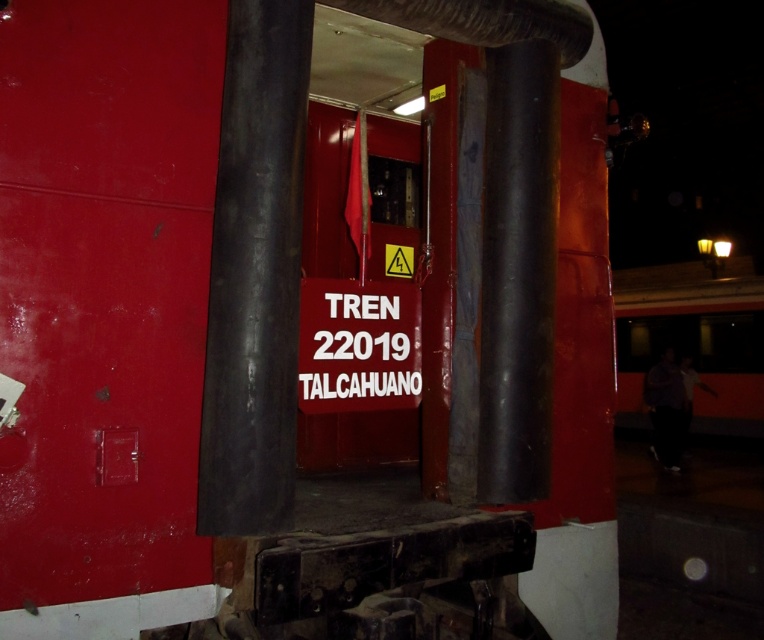
You are a maintenance worker standing 10 feet away from the smooth black pole at center and the white plastic sign at center. You need to reach both objects to inspect them. Which object is closer to you?

The smooth black pole at center is 20.58 inches from the white plastic sign at center. Since you are 10 feet away from both objects, their distance from you is the same. Therefore, both objects are equally close to you.

You are a maintenance worker inspecting the train car at night. You notice the smooth black pole at center and the white plastic sign at center. Which object is closer to you?

The smooth black pole at center is closer to you because it is in front of the white plastic sign at center.